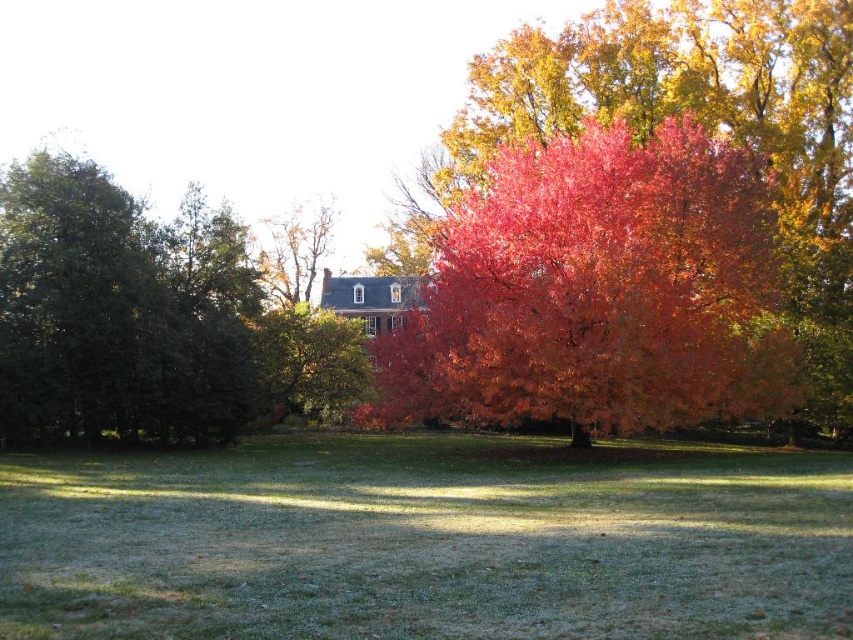
Does vivid red leaves at center have a larger size compared to green matte tree at left?

Yes, vivid red leaves at center is bigger than green matte tree at left.

You are a GUI agent. You are given a task and a screenshot of the screen. Output one action in this format:
    pyautogui.click(x=<x>, y=<y>)
    Task: Click on the vivid red leaves at center
    The image size is (853, 640).
    Given the screenshot: What is the action you would take?
    (596, 292)

Who is more forward, (x=544, y=496) or (x=479, y=198)?

Point (x=544, y=496)

Who is positioned more to the right, green grassy field at lower center or vivid red leaves at center?

vivid red leaves at center is more to the right.

Describe the element at coordinates (426, 541) in the screenshot. I see `green grassy field at lower center` at that location.

Locate an element on the screen. The height and width of the screenshot is (640, 853). green grassy field at lower center is located at coordinates (426, 541).

Can you confirm if green grassy field at lower center is positioned above green matte tree at left?

Actually, green grassy field at lower center is below green matte tree at left.

Is green grassy field at lower center smaller than green matte tree at left?

Yes.

Which is behind, point (502, 516) or point (102, 257)?

The point (102, 257) is more distant.

Where is `green grassy field at lower center`? Image resolution: width=853 pixels, height=640 pixels. green grassy field at lower center is located at coordinates (426, 541).